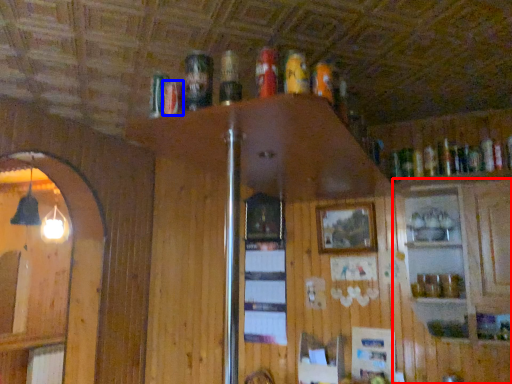
Question: Which of the following is the farthest to the observer, cabinetry (highlighted by a red box) or beer (highlighted by a blue box)?

Choices:
 (A) cabinetry
 (B) beer

Answer: (A)